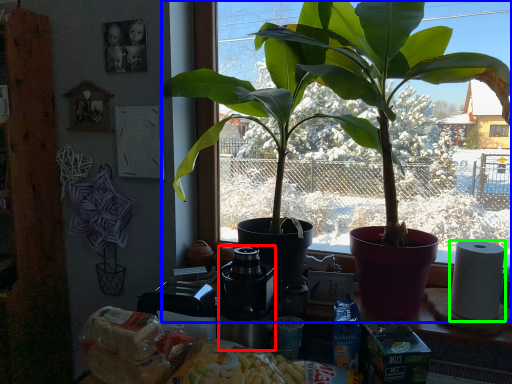
Question: Which object is positioned farthest from coffee machine (highlighted by a red box)? Select from houseplant (highlighted by a blue box) and paper towel (highlighted by a green box).

Choices:
 (A) houseplant
 (B) paper towel

Answer: (B)